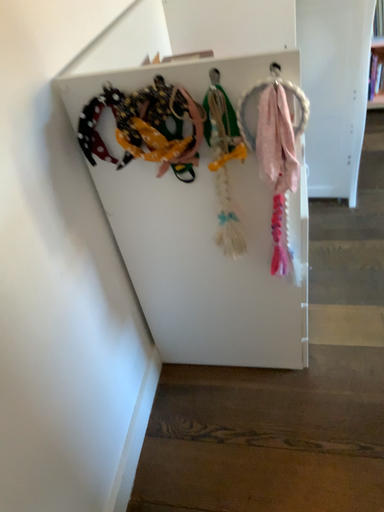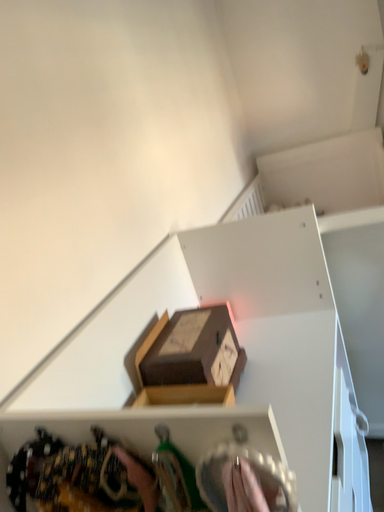
Question: Which way did the camera rotate in the video?

Choices:
 (A) rotated upward
 (B) rotated downward

Answer: (A)